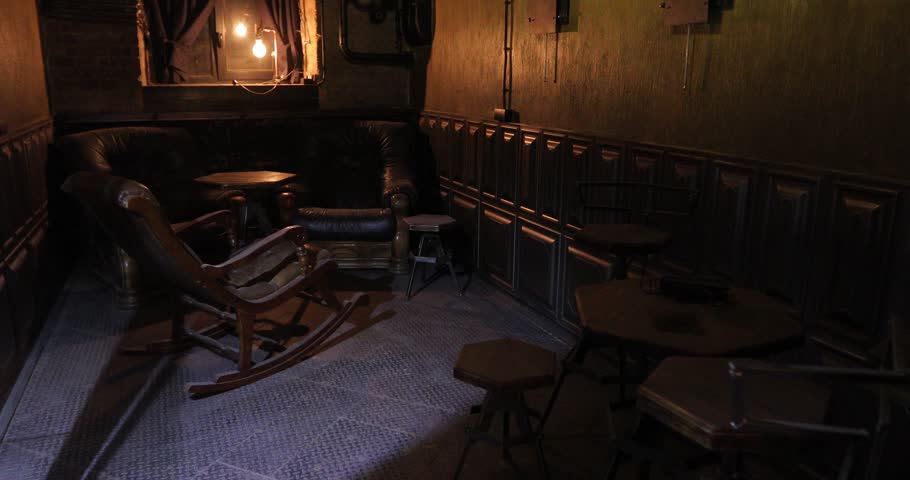
This screenshot has width=910, height=480. Identify the location of stool. 436,225.